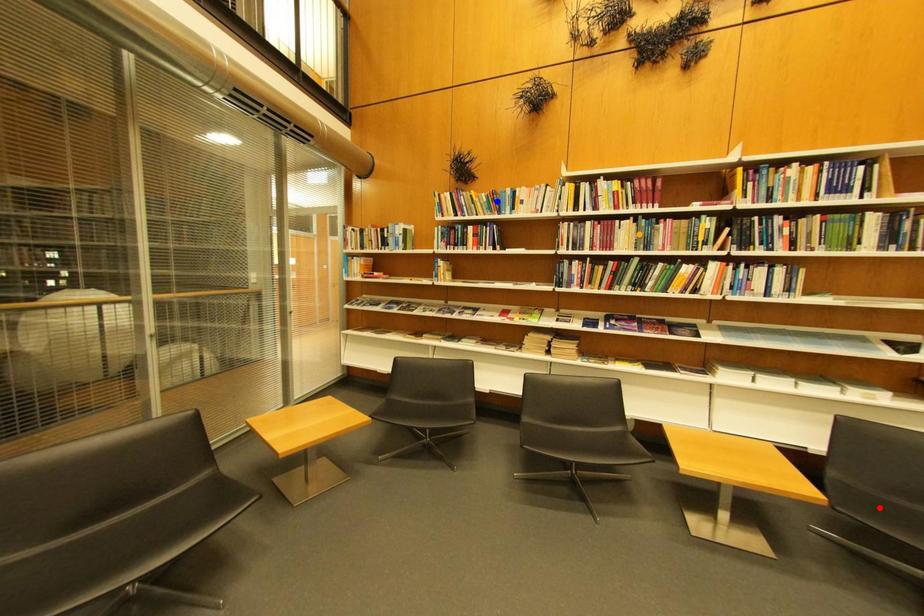
Order these from nearest to farthest:
blue point
orange point
red point

1. red point
2. orange point
3. blue point